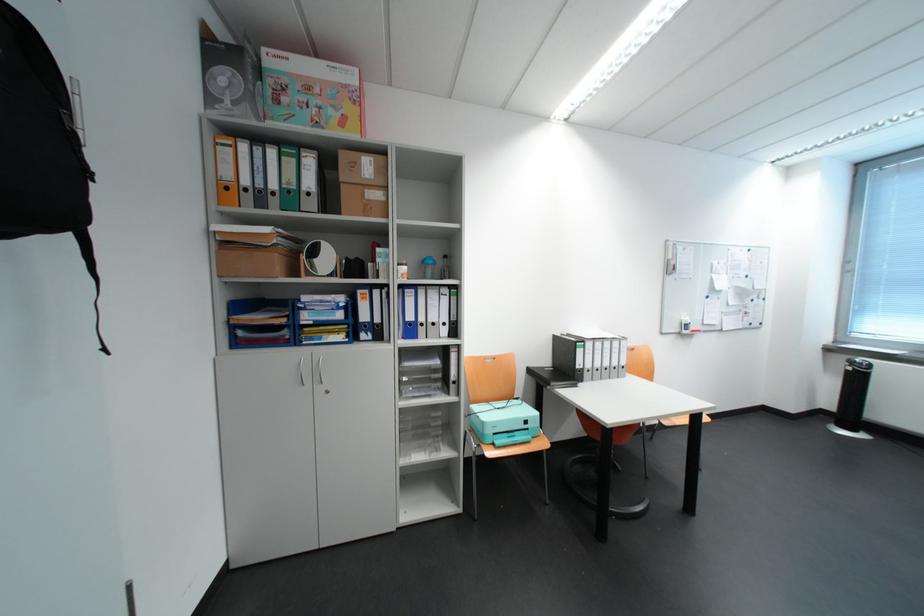
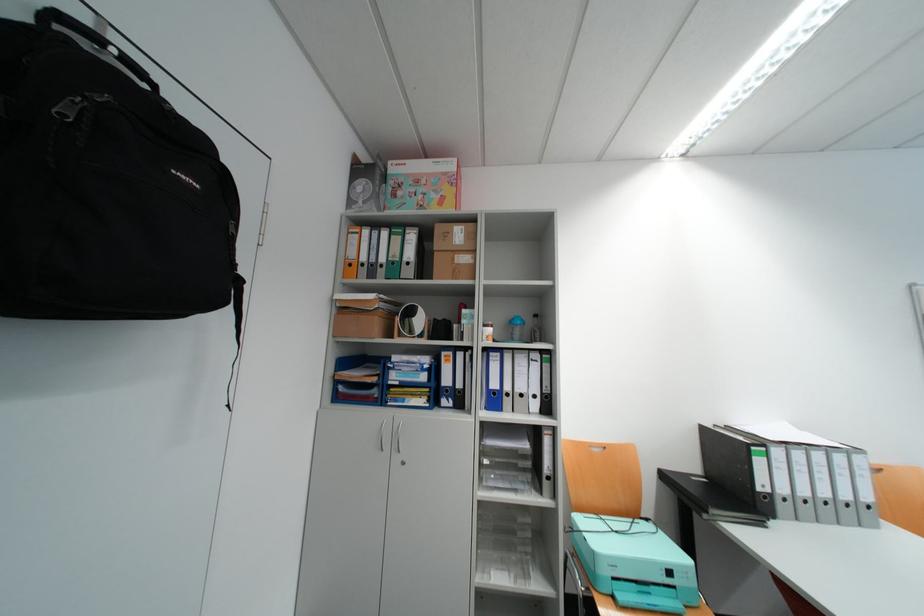
Locate, in the second image, the point that corresponds to (x=521, y=406) in the first image.

(648, 529)